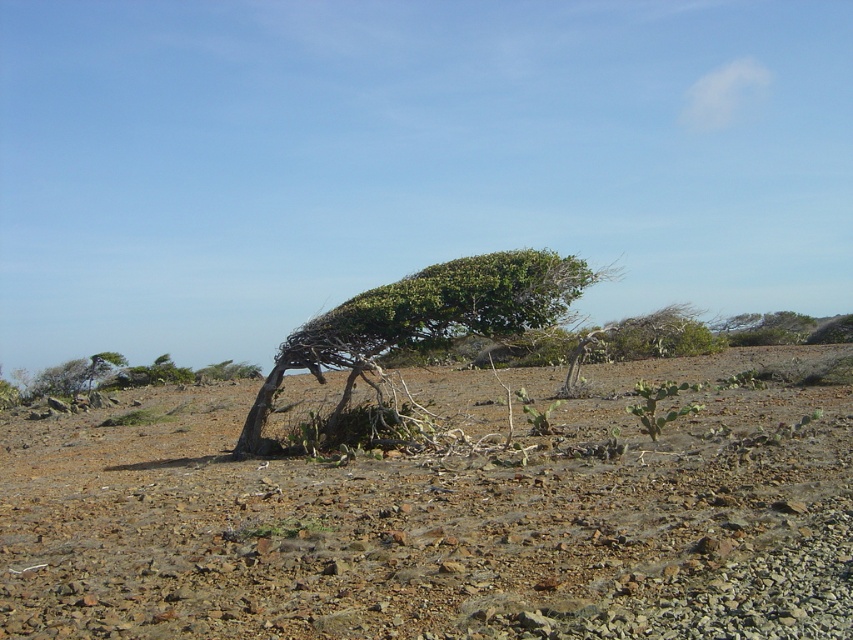
Which is more to the left, brown rocky dirt field at center or green leafy tree at center?

green leafy tree at center

Does brown rocky dirt field at center have a lesser height compared to green leafy tree at center?

Indeed, brown rocky dirt field at center has a lesser height compared to green leafy tree at center.

Between point (344, 540) and point (328, 352), which one is positioned in front?

Point (344, 540) is in front.

The width and height of the screenshot is (853, 640). What are the coordinates of `brown rocky dirt field at center` in the screenshot? It's located at (440, 520).